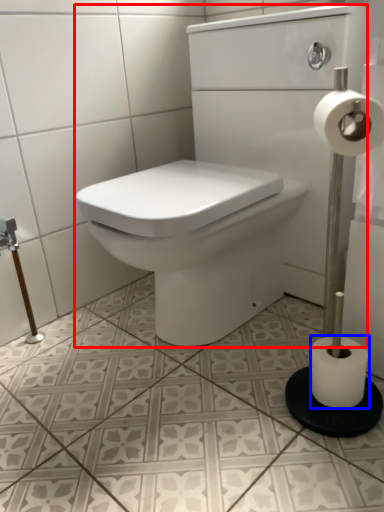
Question: Among these objects, which one is nearest to the camera, sink (highlighted by a red box) or toilet paper (highlighted by a blue box)?

Choices:
 (A) sink
 (B) toilet paper

Answer: (A)